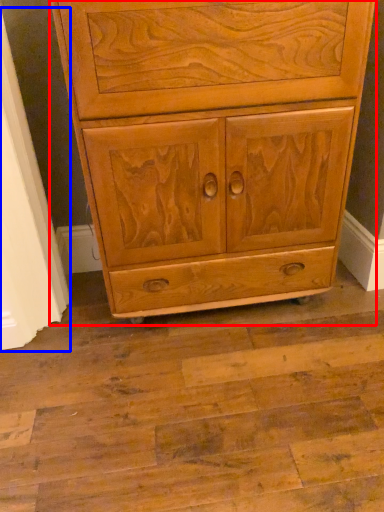
Question: Which object appears farthest to the camera in this image, chest of drawers (highlighted by a red box) or screen door (highlighted by a blue box)?

Choices:
 (A) chest of drawers
 (B) screen door

Answer: (B)